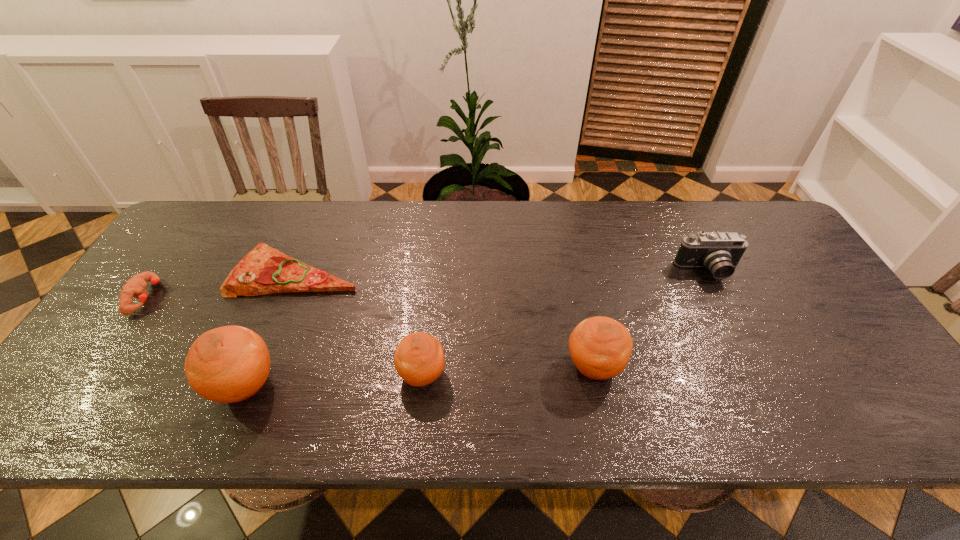
Please point a spot on the right to add another orange. Please provide its 2D coordinates. Your answer should be formatted as a tuple, i.e. [(x, y)], where the tuple contains the x and y coordinates of a point satisfying the conditions above.

[(760, 357)]